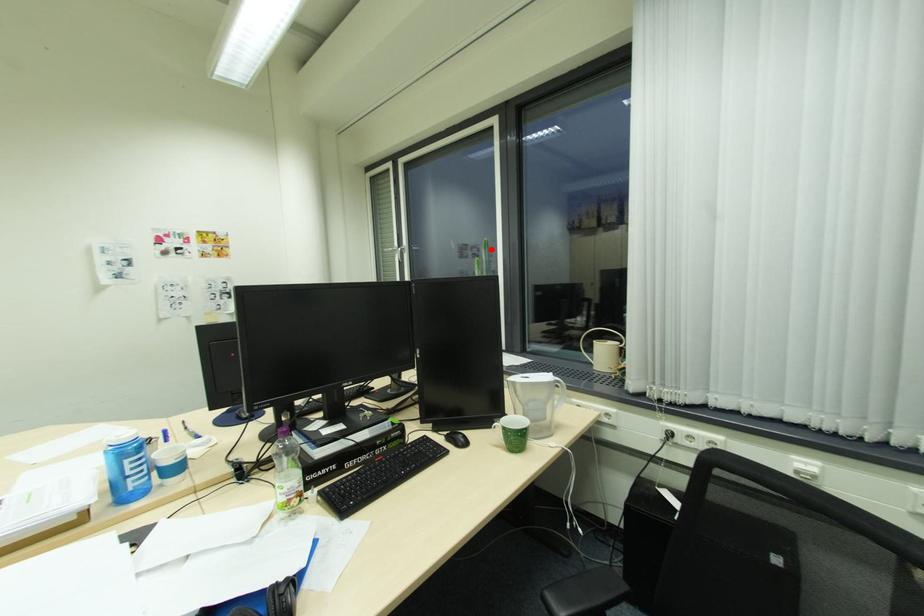
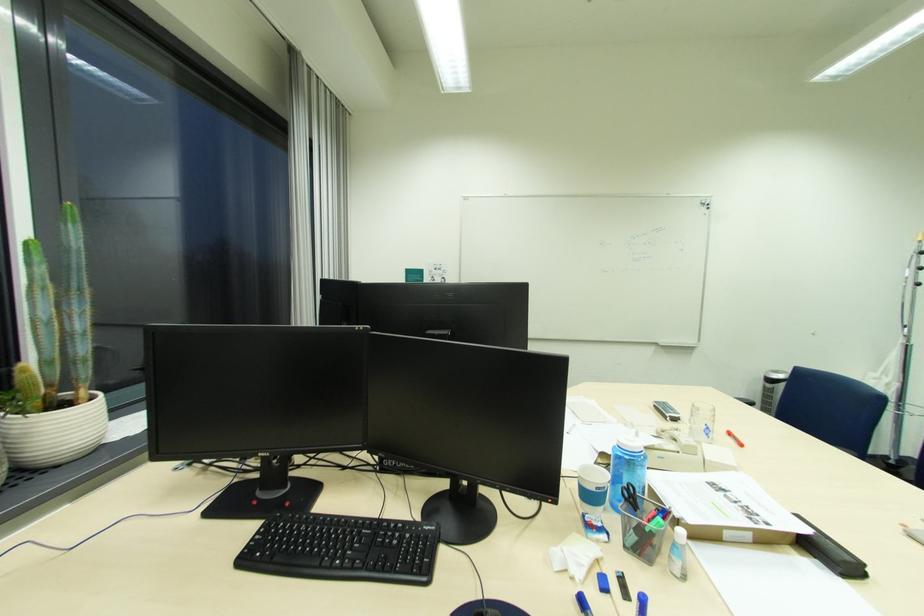
Find the pixel in the second image that matches the highlighted location in the first image.

(79, 225)